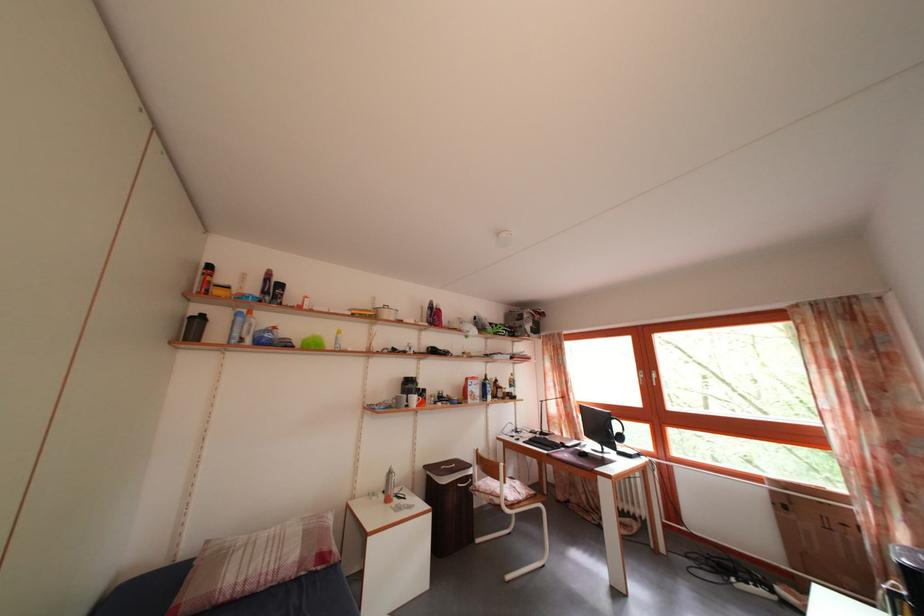
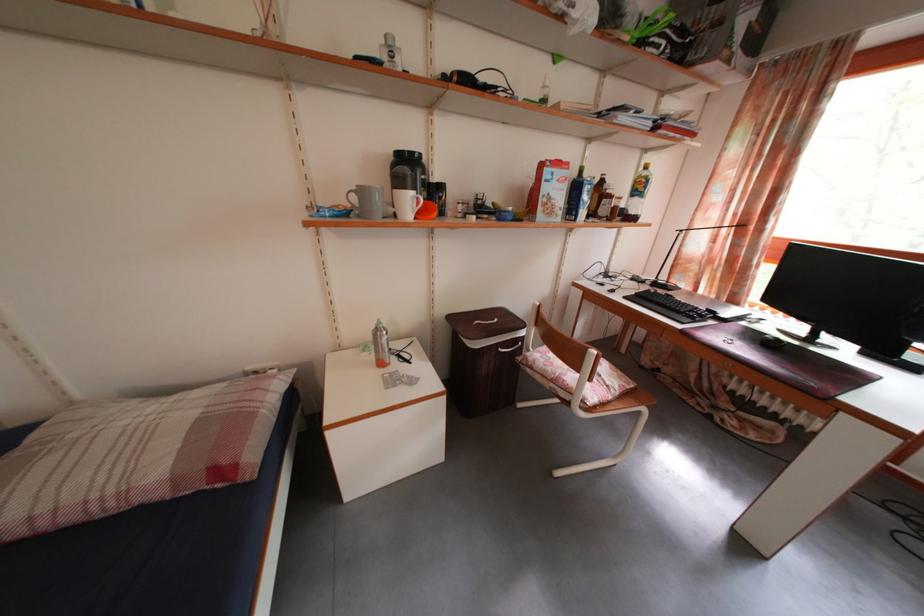
In the second image, find the point that corresponds to point (518, 373) in the first image.

(643, 161)